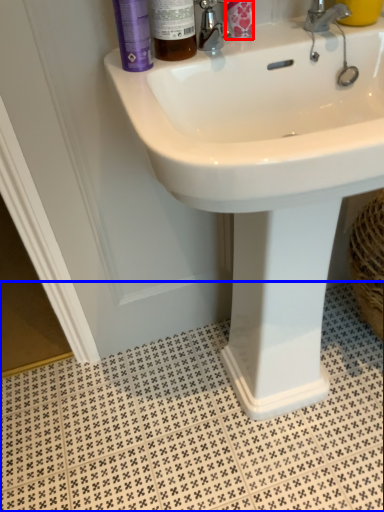
Question: Among these objects, which one is farthest to the camera, toiletry (highlighted by a red box) or tile (highlighted by a blue box)?

Choices:
 (A) toiletry
 (B) tile

Answer: (B)